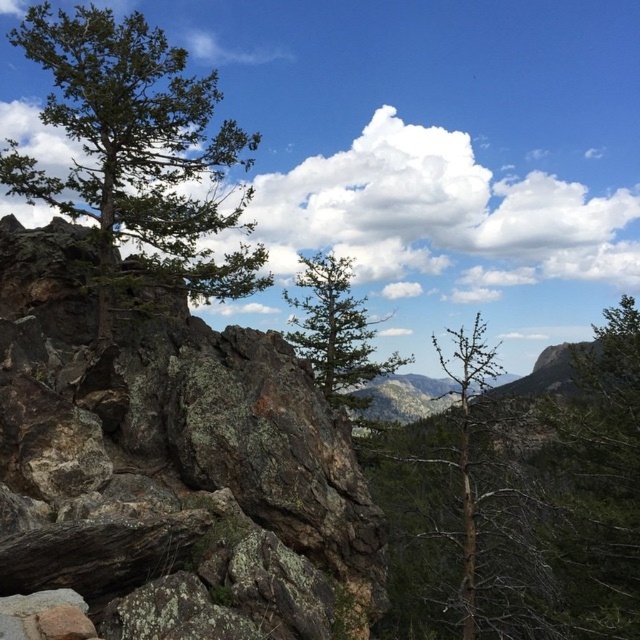
Does rusty brown rock at left appear on the right side of green rough bark tree at center?

Incorrect, rusty brown rock at left is not on the right side of green rough bark tree at center.

Between point (122, 326) and point (592, 525), which one is positioned behind?

Positioned behind is point (592, 525).

Between point (10, 262) and point (577, 518), which one is positioned behind?

The point (577, 518) is behind.

Identify the location of rusty brown rock at left. (172, 467).

Measure the distance between green rough bark tree at center and green matte tree at center.

12.63 meters

Is green rough bark tree at center below green matte tree at center?

Actually, green rough bark tree at center is above green matte tree at center.

Locate an element on the screen. green rough bark tree at center is located at coordinates (600, 480).

You are a GUI agent. You are given a task and a screenshot of the screen. Output one action in this format:
    pyautogui.click(x=<x>, y=<y>)
    Task: Click on the green rough bark tree at center
    The width and height of the screenshot is (640, 640).
    Given the screenshot: What is the action you would take?
    pyautogui.click(x=600, y=480)

Between rusty brown rock at left and green rough bark tree at left, which one is positioned lower?

rusty brown rock at left is lower down.

You are a GUI agent. You are given a task and a screenshot of the screen. Output one action in this format:
    pyautogui.click(x=<x>, y=<y>)
    Task: Click on the rusty brown rock at left
    The height and width of the screenshot is (640, 640).
    Given the screenshot: What is the action you would take?
    pyautogui.click(x=172, y=467)

Is point (44, 465) less distant than point (218, 212)?

Yes, it is in front of point (218, 212).

In order to click on rusty brown rock at left in this screenshot , I will do `click(172, 467)`.